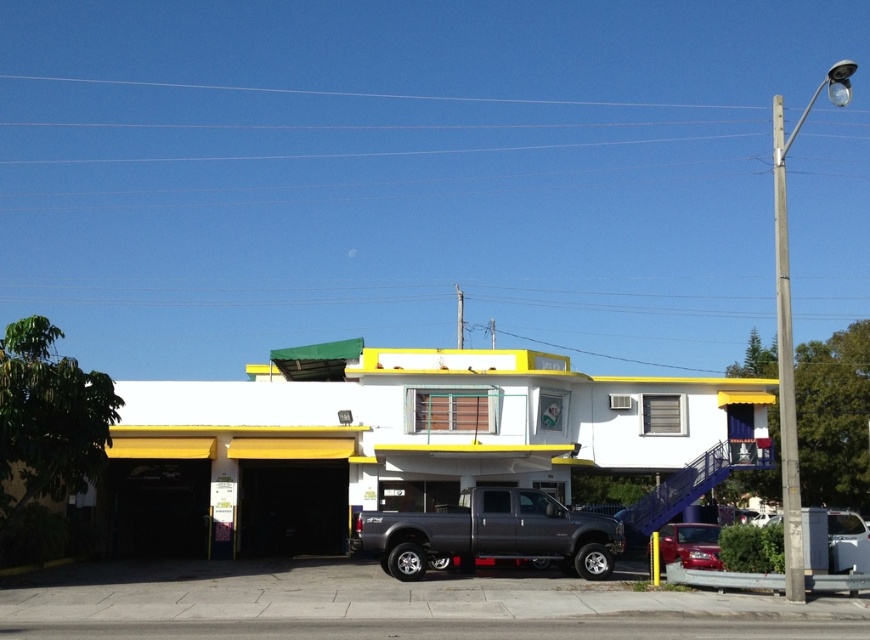
Question: Can you confirm if metallic gray truck at center is smaller than glossy red car at center?

Choices:
 (A) yes
 (B) no

Answer: (B)

Question: Which of the following is the closest to the observer?

Choices:
 (A) (717, 568)
 (B) (579, 524)
 (C) (465, 456)

Answer: (A)

Question: Is metallic gray truck at center smaller than glossy red car at center?

Choices:
 (A) yes
 (B) no

Answer: (B)

Question: Does matte gray truck at center appear on the left side of glossy red car at center?

Choices:
 (A) no
 (B) yes

Answer: (B)

Question: Which point is farther to the camera?

Choices:
 (A) tap(445, 550)
 (B) tap(705, 564)
 (C) tap(228, 493)

Answer: (C)

Question: Which point is closer to the camera?

Choices:
 (A) (666, 557)
 (B) (592, 538)
 (C) (144, 538)

Answer: (B)